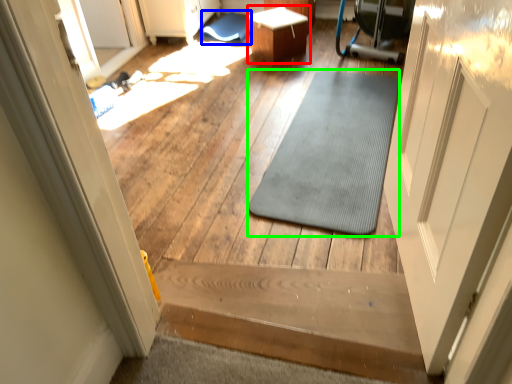
Question: Considering the real-world distances, which object is farthest from table (highlighted by a red box)? bath mat (highlighted by a blue box) or mat (highlighted by a green box)?

Choices:
 (A) bath mat
 (B) mat

Answer: (B)